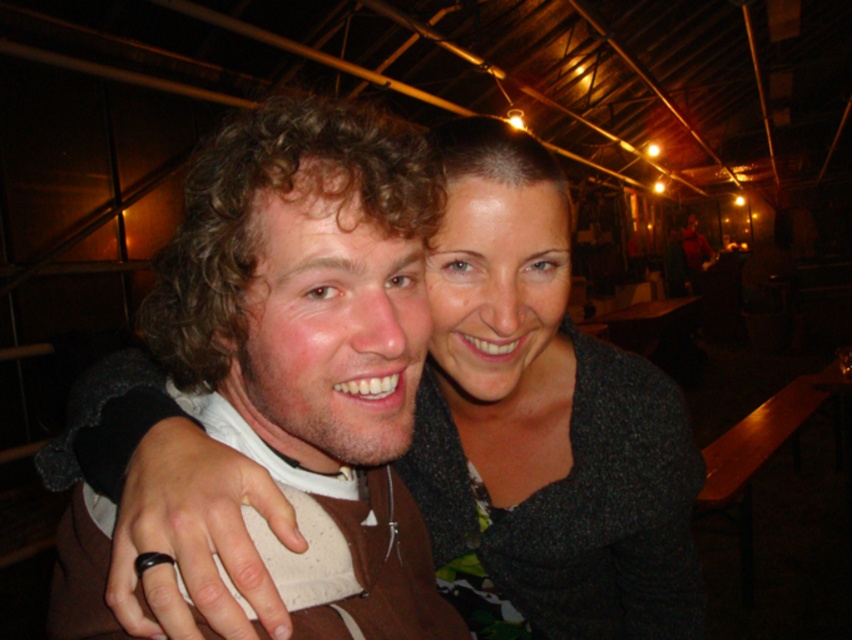
Between point (423, 232) and point (455, 557), which one is positioned behind?

Point (455, 557)

Consider the image. Is brown fuzzy jacket at center bigger than matte gray sweater at center?

No, brown fuzzy jacket at center is not bigger than matte gray sweater at center.

Where is `brown fuzzy jacket at center`? This screenshot has height=640, width=852. brown fuzzy jacket at center is located at coordinates click(312, 349).